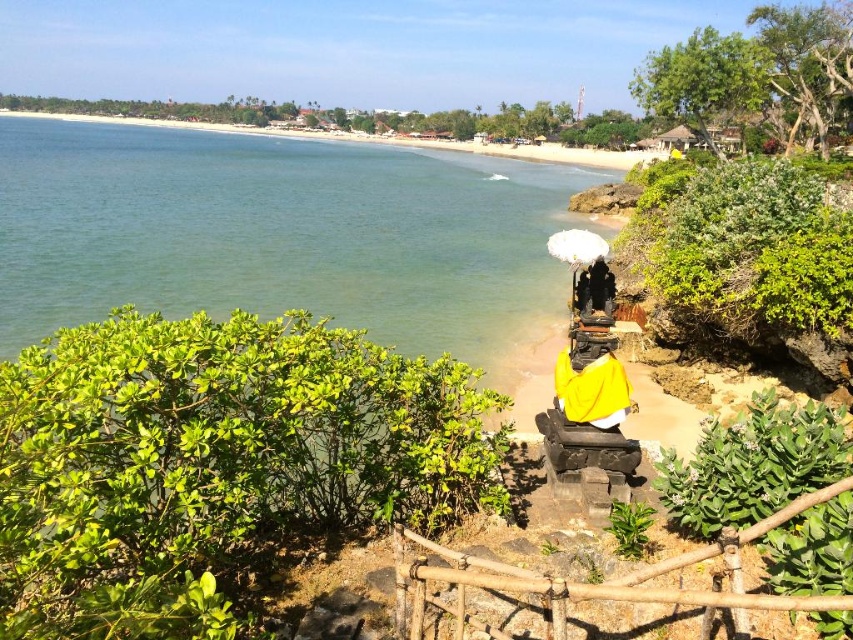
You are standing at the elevated viewpoint overlooking the beach and see the wooden railing in the foreground and the Balinese shrine with the yellow cloth in the midground. There is also a point marked at coordinates point (280, 234). What is the location of the green water relative to the wooden railing and the Balinese shrine?

The point (280, 234) indicates green water at lower left, which means the green water is located to the lower left of both the wooden railing in the foreground and the Balinese shrine in the midground.

You are a visitor standing at the edge of the elevated area and want to take a photo of the yellow draped statue at center. However, you notice the brown bamboo fence at center might block your view. Can you see the statue clearly without moving your position?

The brown bamboo fence at center is much taller than the yellow draped statue at center, so the fence will block your view of the statue.